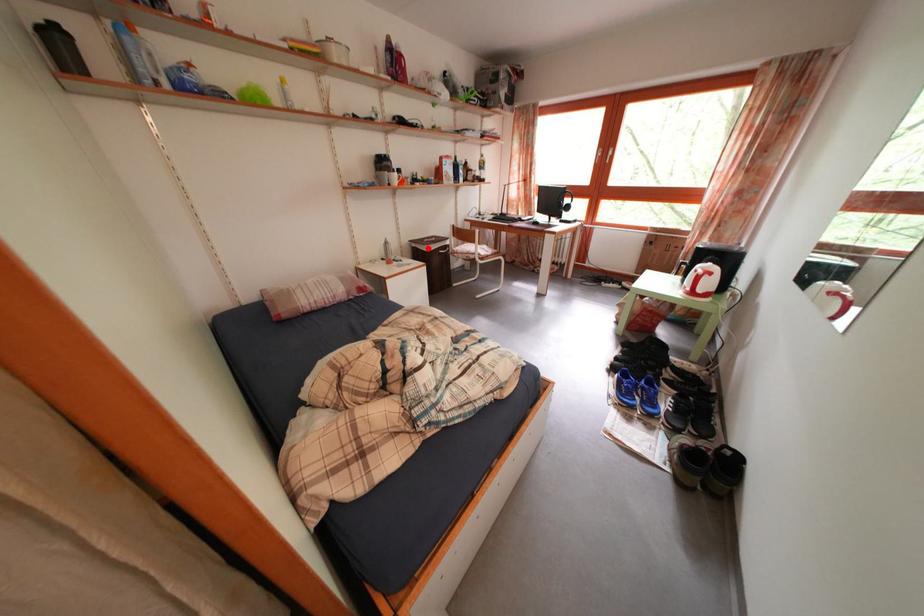
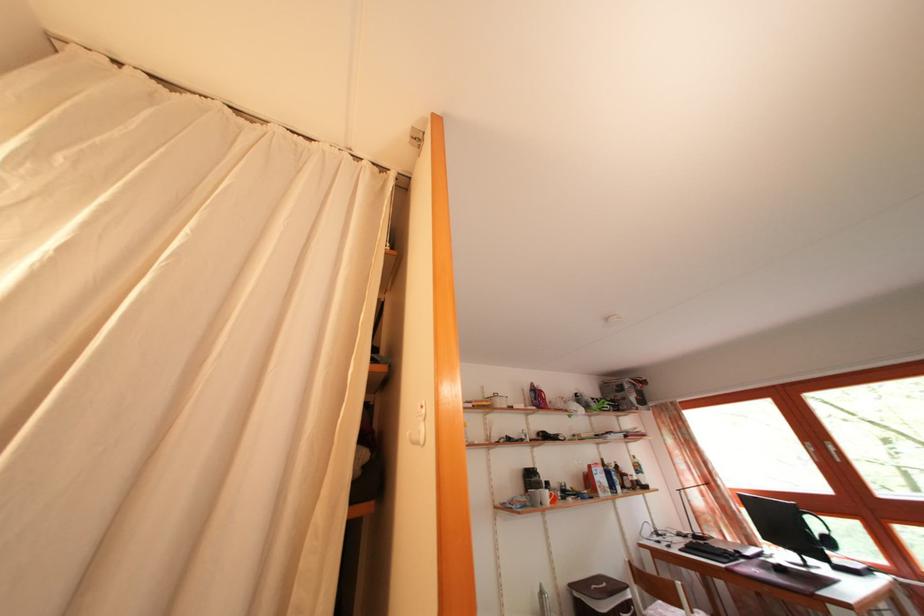
Question: I am providing you with two images of the same scene from different viewpoints. In image1, a red point is highlighted. Considering the same 3D point in image2, which of the following is correct?

Choices:
 (A) It is closer
 (B) It is farther

Answer: (B)